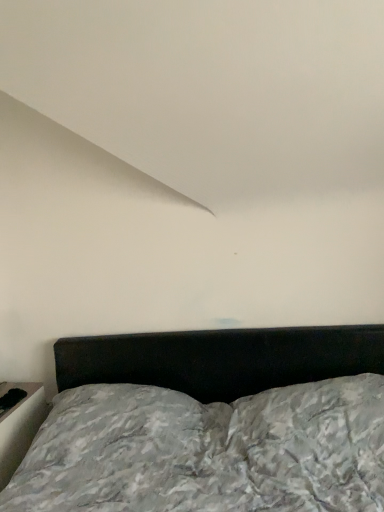
Question: Considering the positions of white glossy table at lower left and textured gray bed at center in the image, is white glossy table at lower left bigger or smaller than textured gray bed at center?

Choices:
 (A) big
 (B) small

Answer: (B)

Question: Is white glossy table at lower left in front of or behind textured gray bed at center in the image?

Choices:
 (A) behind
 (B) front

Answer: (A)

Question: Is white glossy table at lower left spatially inside textured gray bed at center, or outside of it?

Choices:
 (A) outside
 (B) inside

Answer: (A)

Question: Considering the positions of textured gray bed at center and white glossy table at lower left in the image, is textured gray bed at center wider or thinner than white glossy table at lower left?

Choices:
 (A) wide
 (B) thin

Answer: (A)

Question: From a real-world perspective, is textured gray bed at center physically located above or below white glossy table at lower left?

Choices:
 (A) below
 (B) above

Answer: (B)

Question: Is textured gray bed at center in front of or behind white glossy table at lower left in the image?

Choices:
 (A) behind
 (B) front

Answer: (B)

Question: Is textured gray bed at center spatially inside white glossy table at lower left, or outside of it?

Choices:
 (A) inside
 (B) outside

Answer: (B)